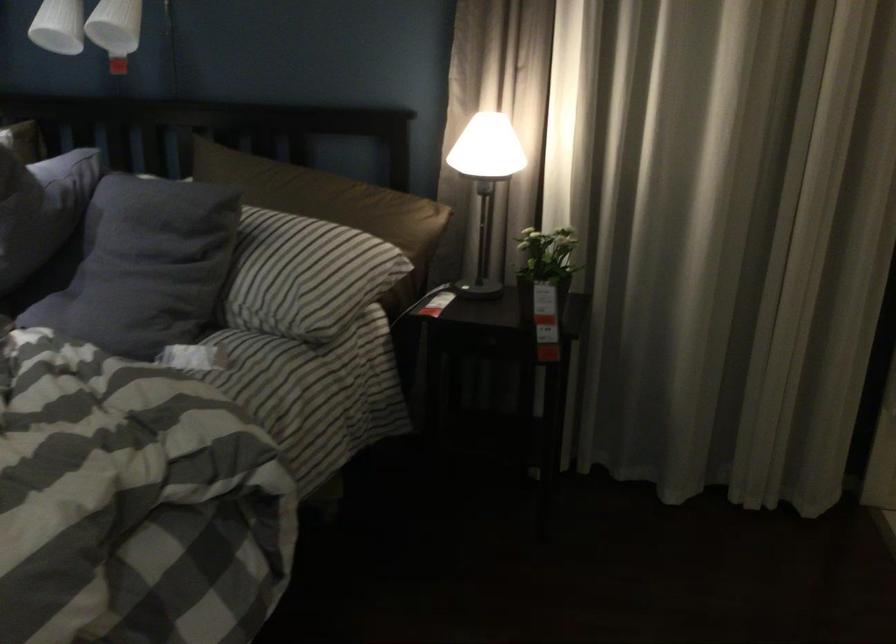
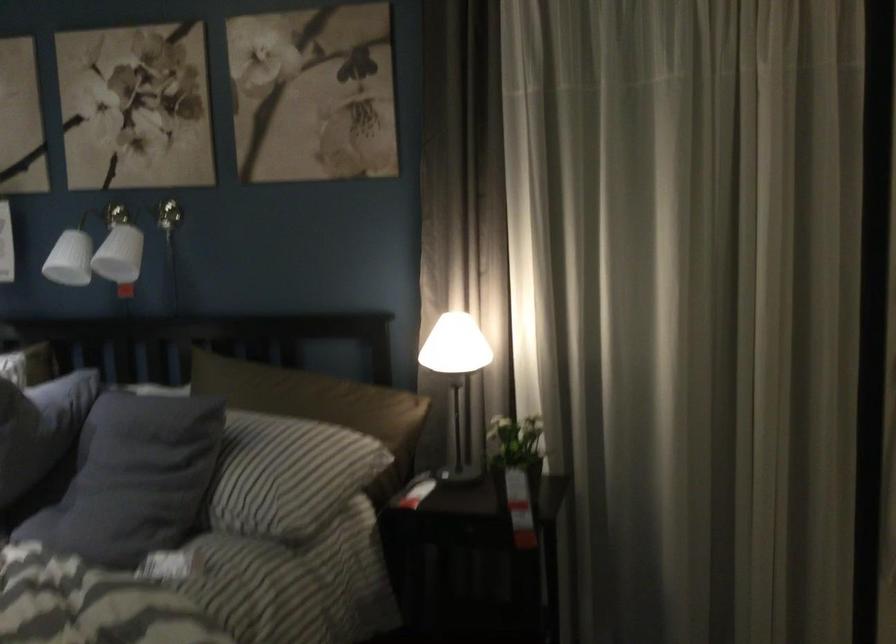
The point at (142, 260) is marked in the first image. Where is the corresponding point in the second image?

(131, 473)